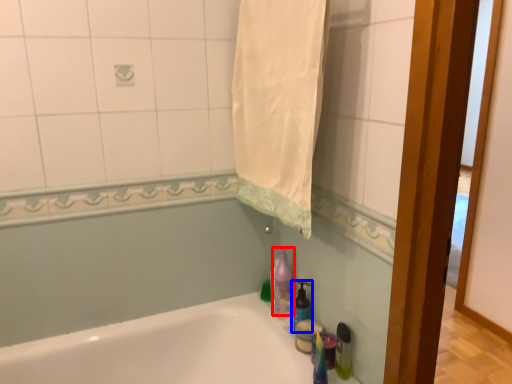
Question: Which object appears farthest to the camera in this image, cleaning product (highlighted by a red box) or soap dispenser (highlighted by a blue box)?

Choices:
 (A) cleaning product
 (B) soap dispenser

Answer: (A)